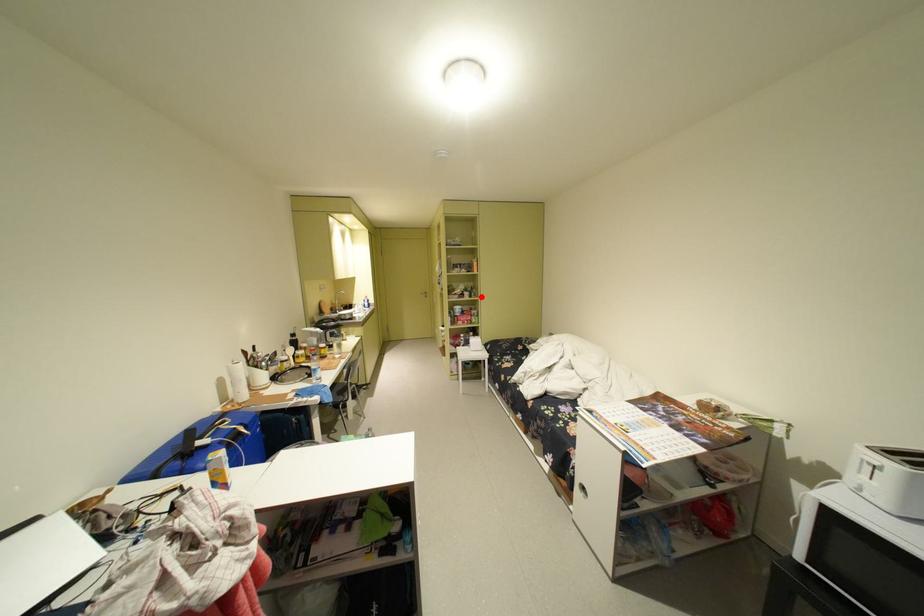
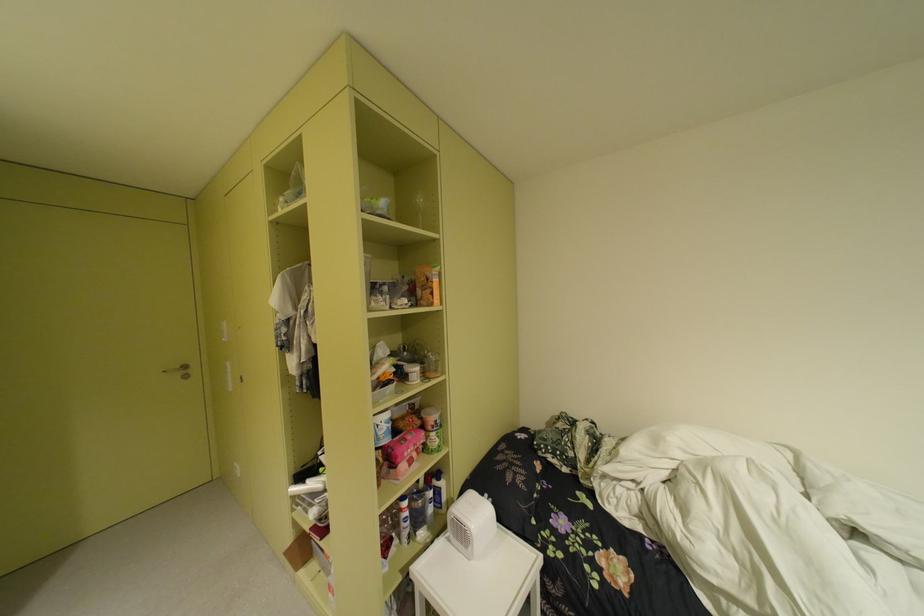
Find the pixel in the second image that matches the highlighted location in the first image.

(434, 376)